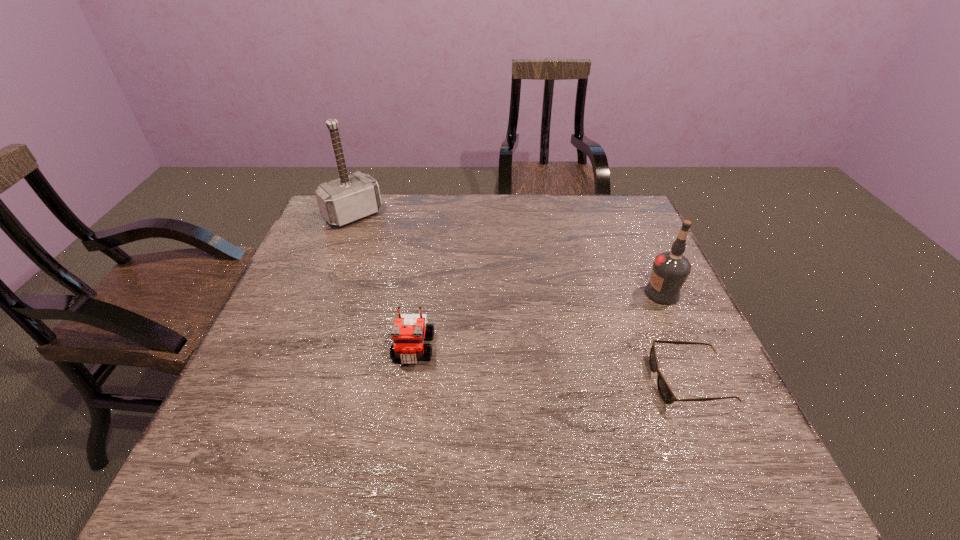
Find the location of `vacant space positioned on the lenses of the sunglasses`. vacant space positioned on the lenses of the sunglasses is located at coordinates (504, 381).

Where is `vacant position located 0.400m for striking with the head of the farthest object`? The image size is (960, 540). vacant position located 0.400m for striking with the head of the farthest object is located at coordinates (440, 295).

The image size is (960, 540). I want to click on vacant area located for striking with the head of the farthest object, so click(433, 289).

Locate an element on the screen. The image size is (960, 540). vacant area situated for striking with the head of the farthest object is located at coordinates (409, 266).

The width and height of the screenshot is (960, 540). What are the coordinates of `free location located 0.320m on the front label of the vodka` in the screenshot? It's located at (548, 346).

Locate an element on the screen. The height and width of the screenshot is (540, 960). vacant space situated on the front label of the vodka is located at coordinates (530, 354).

This screenshot has height=540, width=960. I want to click on vacant position located 0.120m on the front label of the vodka, so click(x=614, y=316).

Where is `object that is at the far edge`? object that is at the far edge is located at coordinates (349, 198).

Find the location of a particular element. The height and width of the screenshot is (540, 960). object situated at the near edge is located at coordinates click(x=665, y=392).

Find the location of a particular element. The image size is (960, 540). object at the left edge is located at coordinates click(x=349, y=198).